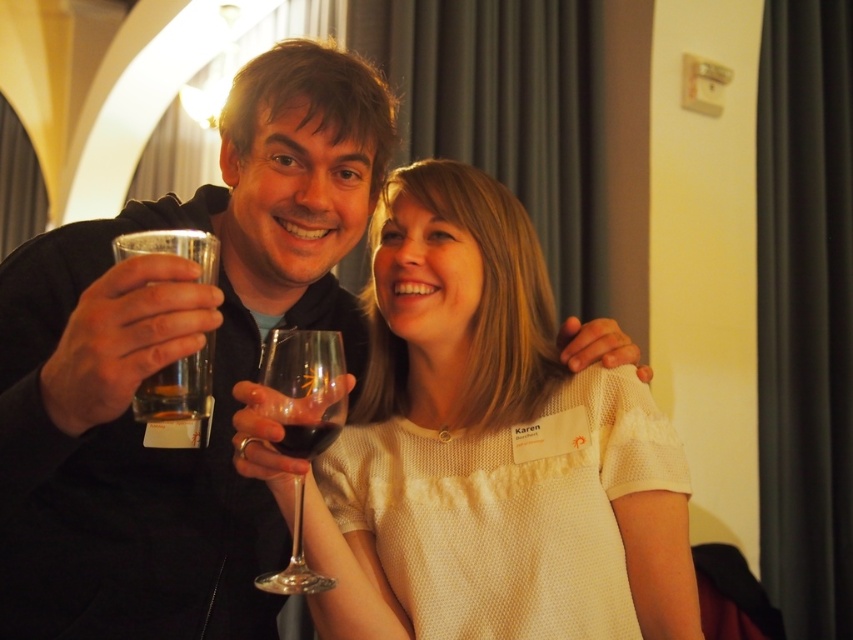
Which is in front, point (299, 362) or point (202, 397)?

Point (202, 397) is more forward.

Does transparent glass at center appear on the left side of clear glass at upper left?

In fact, transparent glass at center is to the right of clear glass at upper left.

Where is `transparent glass at center`? This screenshot has width=853, height=640. transparent glass at center is located at coordinates (305, 388).

The width and height of the screenshot is (853, 640). I want to click on transparent glass at center, so click(305, 388).

Who is positioned more to the right, white textured shirt at center or transparent glass at center?

white textured shirt at center

Between white textured shirt at center and transparent glass at center, which one is positioned higher?

white textured shirt at center

Identify the location of white textured shirt at center. The width and height of the screenshot is (853, 640). coord(490,449).

I want to click on white textured shirt at center, so click(490, 449).

Between point (265, 595) and point (656, 440), which one is positioned in front?

Point (656, 440) is more forward.

Is black matte glass at upper center in front of white textured shirt at center?

Yes, it is in front of white textured shirt at center.

Which is in front, point (73, 440) or point (578, 563)?

Point (73, 440)

At what (x,y) coordinates should I click in order to perform the action: click on black matte glass at upper center. Please return your answer as a coordinate pair (x, y). Looking at the image, I should click on (173, 358).